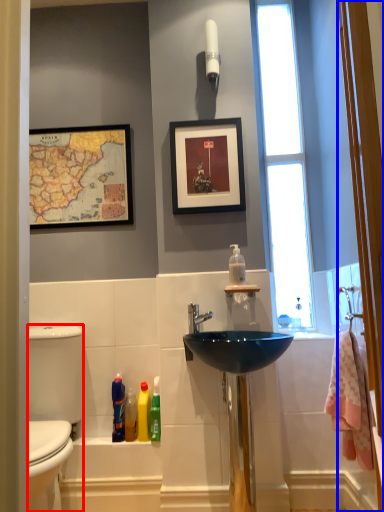
Question: Among these objects, which one is farthest to the camera, gray (highlighted by a red box) or screen door (highlighted by a blue box)?

Choices:
 (A) gray
 (B) screen door

Answer: (A)